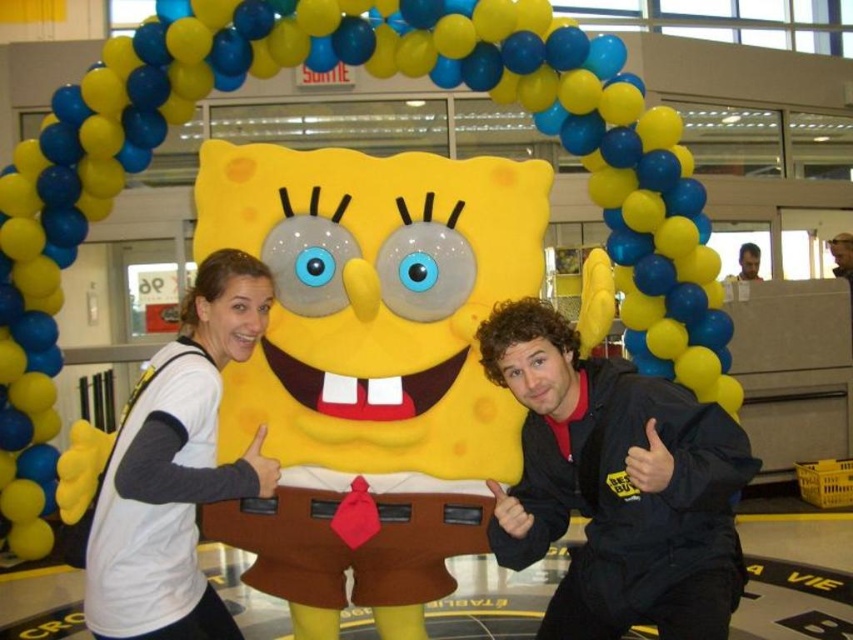
You are a photographer at the event and want to ensure both the white matte shirt at upper left and the smooth skin face at upper right are clearly visible in the photo. Given their height difference, which object should you focus on first to ensure both are in focus?

The white matte shirt at upper left is much taller than the smooth skin face at upper right. To ensure both are in focus, focus on the white matte shirt at upper left first since it is taller and likely farther away, allowing the smooth skin face at upper right to remain in the depth of field.

You are standing in front of the SpongeBob SquarePants mascot and want to take a photo. There are two points marked on the mascot, one at coordinates point [259,289] and another at point [840,269]. Which point would appear larger in your camera view?

Point [259,289] is closer to the camera than point [840,269], so it would appear larger in the camera view.

You are a photographer at the SpongeBob SquarePants mascot event. You need to locate the white matte shirt at upper left. According to the coordinates provided, where exactly is it located?

The white matte shirt at upper left is located at point (177, 468).